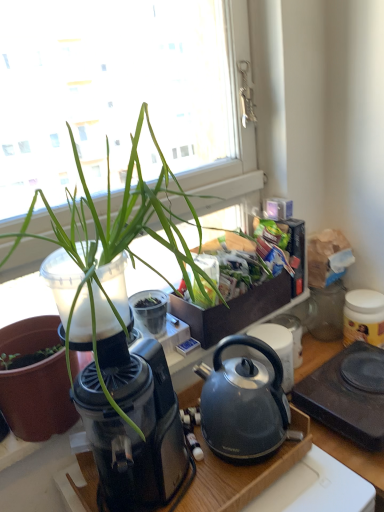
Question: Is green leafy plant at upper left positioned before matte black pot at left?

Choices:
 (A) yes
 (B) no

Answer: (A)

Question: Does green leafy plant at upper left have a larger size compared to matte black pot at left?

Choices:
 (A) no
 (B) yes

Answer: (B)

Question: From the image's perspective, is green leafy plant at upper left under matte black pot at left?

Choices:
 (A) no
 (B) yes

Answer: (A)

Question: Is green leafy plant at upper left aimed at matte black pot at left?

Choices:
 (A) yes
 (B) no

Answer: (B)

Question: Can you confirm if green leafy plant at upper left is smaller than matte black pot at left?

Choices:
 (A) yes
 (B) no

Answer: (B)

Question: From a real-world perspective, is green leafy plant at upper left located higher than matte black pot at left?

Choices:
 (A) yes
 (B) no

Answer: (A)

Question: Considering the relative sizes of satin black kettle at center and matte black kettle at center, the 4th appliance when ordered from right to left, in the image provided, is satin black kettle at center thinner than matte black kettle at center, the 4th appliance when ordered from right to left,?

Choices:
 (A) no
 (B) yes

Answer: (A)

Question: Is satin black kettle at center shorter than matte black kettle at center, the first appliance viewed from the left?

Choices:
 (A) yes
 (B) no

Answer: (B)

Question: From a real-world perspective, is satin black kettle at center positioned under matte black kettle at center, the first appliance viewed from the left, based on gravity?

Choices:
 (A) no
 (B) yes

Answer: (A)

Question: Is satin black kettle at center facing towards matte black kettle at center, the 4th appliance when ordered from right to left?

Choices:
 (A) yes
 (B) no

Answer: (B)

Question: Is satin black kettle at center facing away from matte black kettle at center, the first appliance viewed from the left?

Choices:
 (A) yes
 (B) no

Answer: (B)

Question: Are satin black kettle at center and matte black kettle at center, the first appliance viewed from the left, far apart?

Choices:
 (A) yes
 (B) no

Answer: (B)

Question: Is matte black kettle at center, the 4th appliance when ordered from right to left, bigger than black plastic hot plate at lower right, arranged as the second appliance when viewed from the right?

Choices:
 (A) yes
 (B) no

Answer: (B)